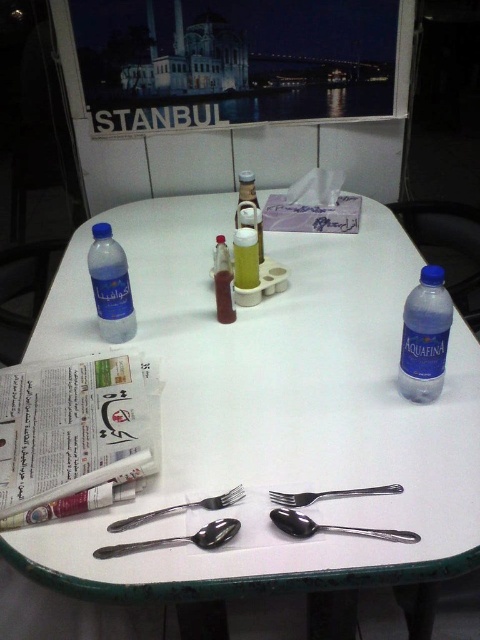
You are standing at the origin point of a coordinate system where the table is located at coordinates 0.641, 0.571. If you want to place a new plate exactly in the center of the white plastic table at center, where should you place it?

You should place the new plate at the coordinates (274, 410), which is the center of the white plastic table at center.

You are sitting at the table and want to grab the blue matte water bottle at left. To reach it, will you have to move the matte plastic bottle at center out of the way?

The blue matte water bottle at left is in front of the matte plastic bottle at center, so you can reach it without moving the matte plastic bottle at center.

You are a photographer standing at the camera position. You want to take a closeup photo of the blue matte water bottle at left without moving any objects. Can you do it with a standard zoom lens that has a maximum focal length of 200mm? Assume the minimum focusing distance of the lens is 1 meter.

The blue matte water bottle at left is 1.11 meters away from camera. Since the minimum focusing distance of the lens is 1 meter, the photographer can focus on the blue matte water bottle at left as it is beyond the minimum distance, allowing for a clear closeup photo.